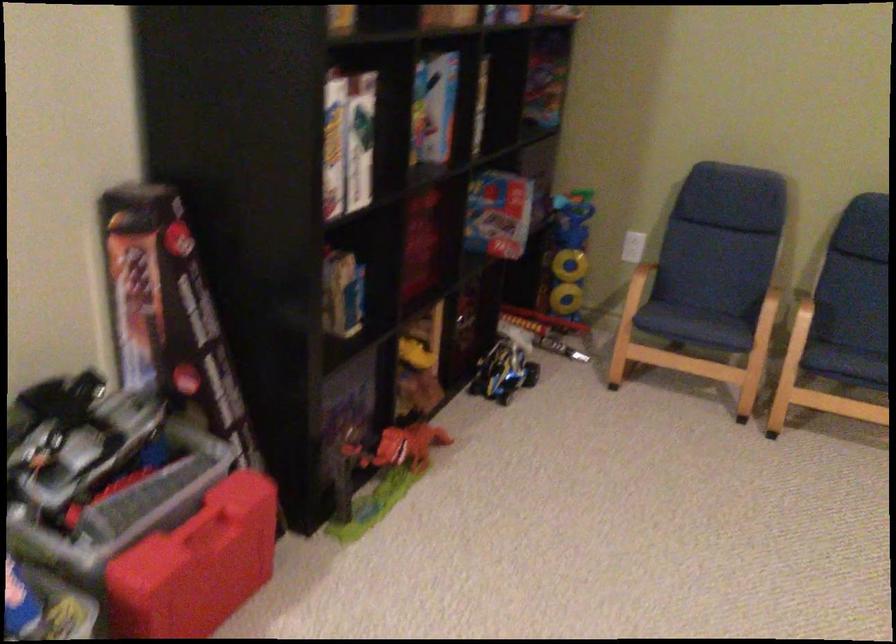
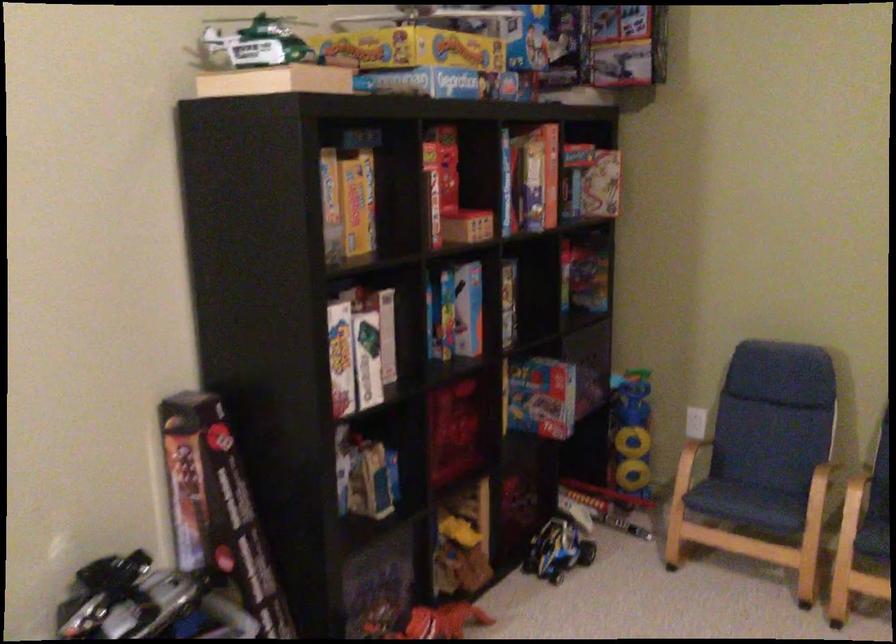
Where in the second image is the point corresponding to pixel 139 285 from the first image?

(186, 471)